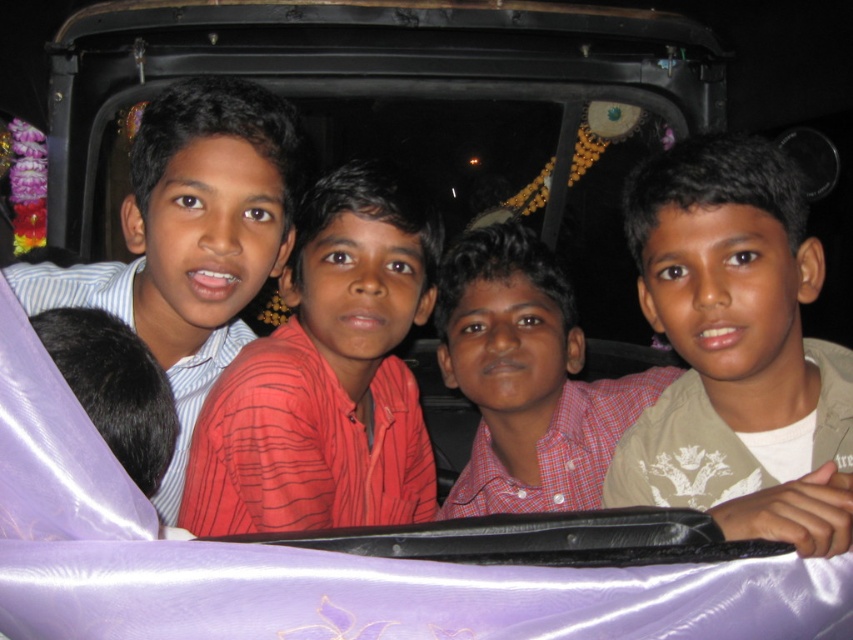
Who is more forward, (755, 266) or (108, 394)?

Point (108, 394) is more forward.

Does beige textured shirt at right have a lesser width compared to black fur at left?

Incorrect, beige textured shirt at right's width is not less than black fur at left's.

The image size is (853, 640). Find the location of `beige textured shirt at right`. beige textured shirt at right is located at coordinates (735, 349).

At what (x,y) coordinates should I click in order to perform the action: click on beige textured shirt at right. Please return your answer as a coordinate pair (x, y). Looking at the image, I should click on (735, 349).

Between beige textured shirt at right and red checkered shirt at center, which one appears on the left side from the viewer's perspective?

red checkered shirt at center

Is point (700, 188) positioned after point (498, 272)?

No, (700, 188) is in front of (498, 272).

The width and height of the screenshot is (853, 640). In order to click on beige textured shirt at right in this screenshot , I will do `click(735, 349)`.

How far apart are beige textured shirt at right and red striped shirt at center?

They are 1.16 meters apart.

This screenshot has height=640, width=853. Describe the element at coordinates (735, 349) in the screenshot. I see `beige textured shirt at right` at that location.

Does point (714, 176) lie behind point (193, 444)?

That is False.

Identify the location of beige textured shirt at right. (735, 349).